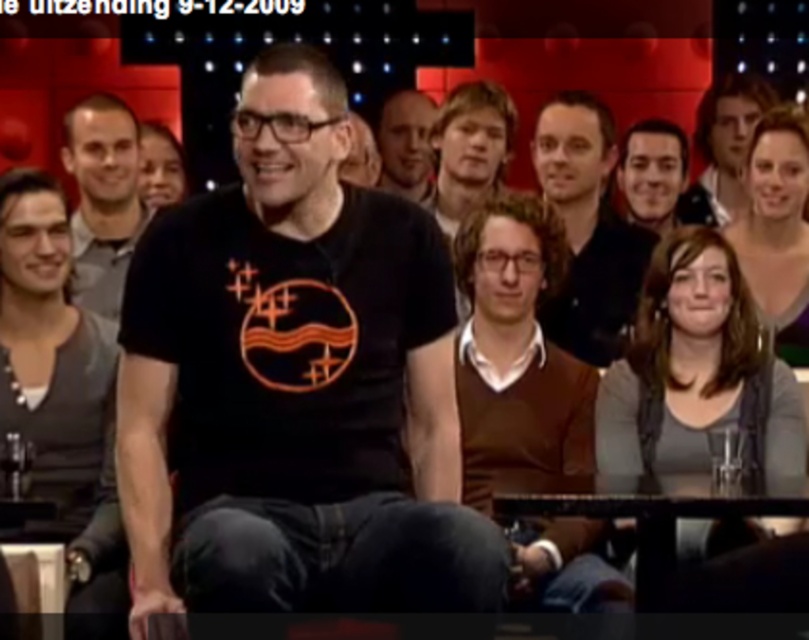
You are a costume designer reviewing a scene from a TV show. You notice two items of clothing in the background. The brown sweater vest at center and the matte black shirt at upper center. Which one is positioned higher up in the image?

The matte black shirt at upper center is positioned higher up in the image than the brown sweater vest at center.

You are a graphic designer working on a project that requires precise placement of elements. You need to place a new element at coordinates that are exactly halfway between the matte black shirt at upper right and the center of the image. What are the coordinates where you should place the new element?

The coordinates for the matte black shirt at upper right are given as point (723, 147). The center of the image is at (404, 320). To find the midpoint between these two points, calculate the average of the x and y coordinates separately. The midpoint x is 0.230 plus 0.5 divided by 2 equals 0.365. The midpoint y is 0.895 plus 0.5 divided by 2 equals 0.6975. Therefore, the coordinates for placing the new element are approximately (564, 233).